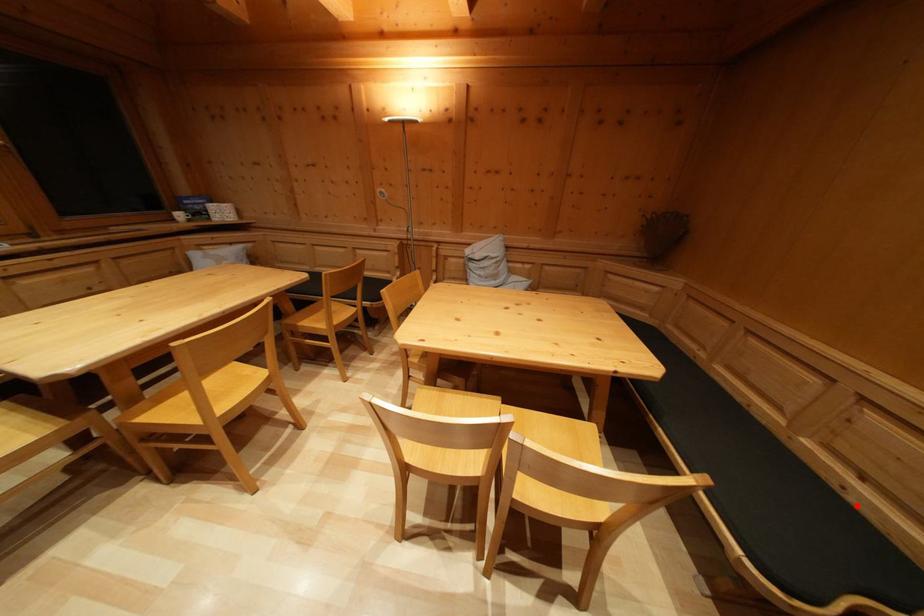
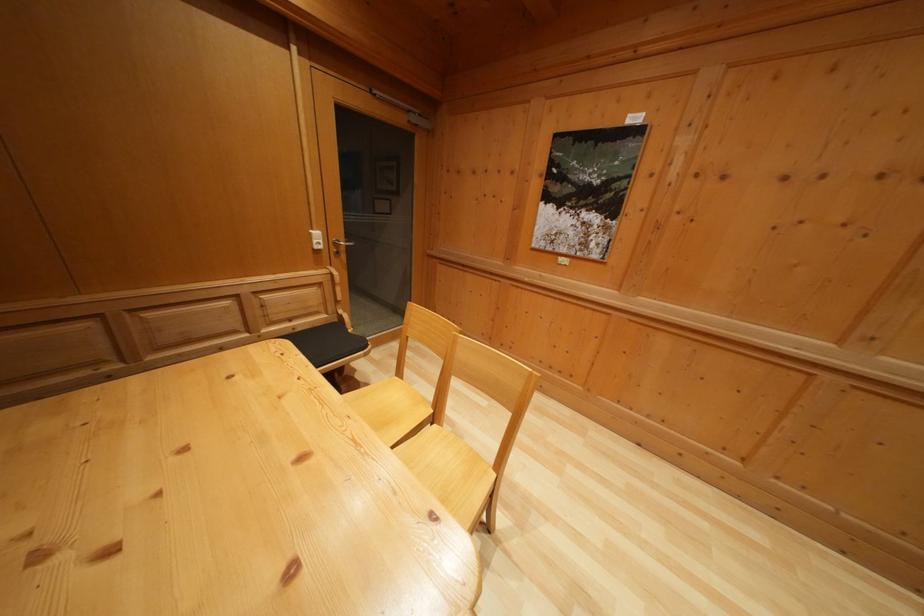
Question: I am providing you with two images of the same scene from different viewpoints. A red point is shown in image1. For the corresponding object point in image2, is it positioned nearer or farther from the camera?

Choices:
 (A) Nearer
 (B) Farther

Answer: (A)